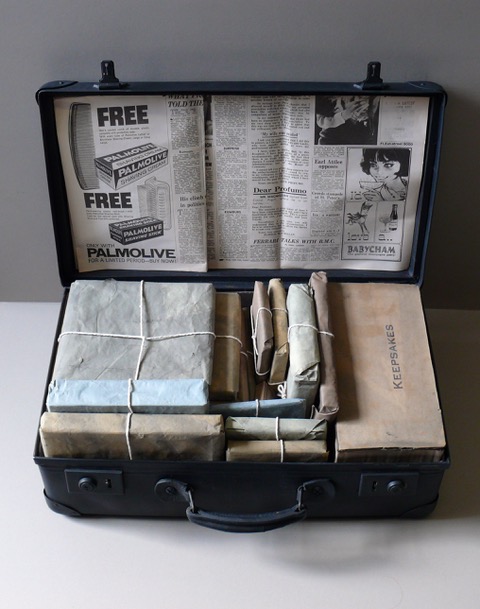
This screenshot has height=609, width=480. In order to click on box in this screenshot , I will do `click(180, 440)`.